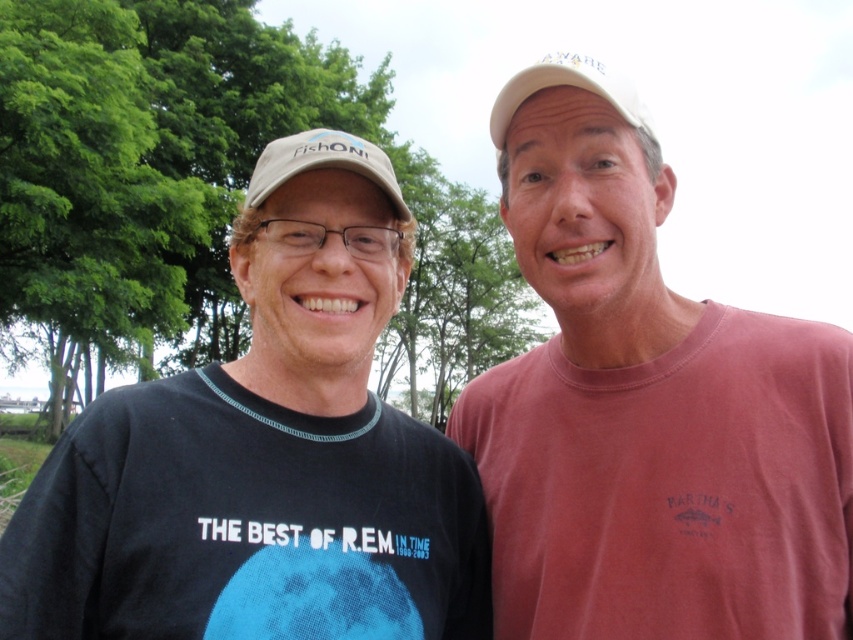
Where is `pink cotton t-shirt at right`? pink cotton t-shirt at right is located at coordinates (647, 406).

Can you confirm if pink cotton t-shirt at right is positioned to the right of green leafy tree at upper left?

Correct, you'll find pink cotton t-shirt at right to the right of green leafy tree at upper left.

What are the coordinates of `pink cotton t-shirt at right` in the screenshot? It's located at (647, 406).

Does matte beige baseball cap at left have a greater height compared to white fabric baseball cap at upper center?

In fact, matte beige baseball cap at left may be shorter than white fabric baseball cap at upper center.

Who is positioned more to the left, matte beige baseball cap at left or white fabric baseball cap at upper center?

matte beige baseball cap at left

Describe the element at coordinates (322, 163) in the screenshot. I see `matte beige baseball cap at left` at that location.

Where is `matte beige baseball cap at left`? The width and height of the screenshot is (853, 640). matte beige baseball cap at left is located at coordinates (322, 163).

Is point (61, 118) farther from viewer compared to point (293, 170)?

Yes.

Consider the image. Is green leafy tree at upper left to the left of matte beige baseball cap at left from the viewer's perspective?

Indeed, green leafy tree at upper left is positioned on the left side of matte beige baseball cap at left.

This screenshot has width=853, height=640. Describe the element at coordinates (201, 189) in the screenshot. I see `green leafy tree at upper left` at that location.

Identify the location of green leafy tree at upper left. Image resolution: width=853 pixels, height=640 pixels. (201, 189).